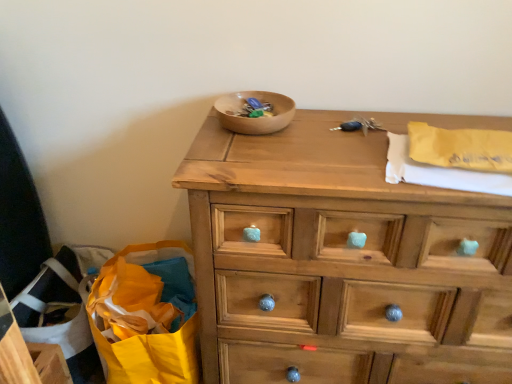
Measure the distance between point (207, 136) and camera.

Point (207, 136) is 3.41 feet away from camera.

This screenshot has height=384, width=512. What do you see at coordinates (439, 172) in the screenshot?
I see `yellow paper at upper right` at bounding box center [439, 172].

Identify the location of wooden bowl at center. The height and width of the screenshot is (384, 512). point(254,118).

Identify the location of yellow paper bag at lower left. (150, 356).

Is wooden chest of drawers at center aimed at yellow paper at upper right?

No, wooden chest of drawers at center is not aimed at yellow paper at upper right.

Is wooden chest of drawers at center thinner than yellow paper at upper right?

In fact, wooden chest of drawers at center might be wider than yellow paper at upper right.

In the image, is wooden chest of drawers at center on the left side or the right side of yellow paper at upper right?

Based on their positions, wooden chest of drawers at center is located to the left of yellow paper at upper right.

Locate an element on the screen. chest of drawers lying on the left of yellow paper at upper right is located at coordinates 341,262.

Looking at this image, can you tell me how much yellow paper at upper right and yellow paper bag at lower left differ in facing direction?

There is a 9.72-degree angle between the facing directions of yellow paper at upper right and yellow paper bag at lower left.

I want to click on shopping bag behind the yellow paper at upper right, so click(150, 356).

Which is closer to the camera, (437, 179) or (181, 373)?

The point (437, 179) is in front.

Is yellow paper at upper right next to yellow paper bag at lower left and touching it?

No, yellow paper at upper right is not with yellow paper bag at lower left.

Could you tell me if yellow paper bag at lower left is facing yellow paper at upper right?

No, yellow paper bag at lower left does not turn towards yellow paper at upper right.

Which is more to the right, yellow paper bag at lower left or yellow paper at upper right?

yellow paper at upper right is more to the right.

Is yellow paper bag at lower left wider or thinner than yellow paper at upper right?

Clearly, yellow paper bag at lower left has more width compared to yellow paper at upper right.

Which object is further away from the camera taking this photo, yellow paper bag at lower left or yellow paper at upper right?

yellow paper bag at lower left is behind.

From the image's perspective, would you say yellow paper bag at lower left is shown under wooden chest of drawers at center?

Correct, yellow paper bag at lower left appears lower than wooden chest of drawers at center in the image.

The width and height of the screenshot is (512, 384). In order to click on the chest of drawers that is in front of the yellow paper bag at lower left in this screenshot , I will do `click(341, 262)`.

Does yellow paper bag at lower left have a greater width compared to wooden chest of drawers at center?

Yes.

From the image's perspective, relative to wooden bowl at center, is wooden chest of drawers at center above or below?

Based on their image positions, wooden chest of drawers at center is located beneath wooden bowl at center.

Is wooden chest of drawers at center looking in the opposite direction of wooden bowl at center?

No.

Who is taller, wooden chest of drawers at center or wooden bowl at center?

Standing taller between the two is wooden chest of drawers at center.

In the image, is wooden chest of drawers at center on the left side or the right side of wooden bowl at center?

From the image, it's evident that wooden chest of drawers at center is to the right of wooden bowl at center.

From the image's perspective, does wooden bowl at center appear higher than yellow paper at upper right?

Yes, from the image's perspective, wooden bowl at center is above yellow paper at upper right.

Between wooden bowl at center and yellow paper at upper right, which one has smaller size?

yellow paper at upper right is smaller.

From a real-world perspective, who is located lower, wooden bowl at center or yellow paper at upper right?

yellow paper at upper right is physically lower.

Is yellow paper at upper right surrounding wooden bowl at center?

No, yellow paper at upper right does not contain wooden bowl at center.

Is yellow paper at upper right looking in the opposite direction of wooden bowl at center?

No, yellow paper at upper right is not facing away from wooden bowl at center.

Considering the sizes of objects yellow paper at upper right and wooden bowl at center in the image provided, who is smaller, yellow paper at upper right or wooden bowl at center?

yellow paper at upper right.

Is yellow paper at upper right taller or shorter than wooden bowl at center?

Clearly, yellow paper at upper right is shorter compared to wooden bowl at center.

The height and width of the screenshot is (384, 512). Find the location of `the chest of drawers that appears in front of the yellow paper at upper right`. the chest of drawers that appears in front of the yellow paper at upper right is located at coordinates click(341, 262).

Identify the location of shopping bag behind the yellow paper at upper right. This screenshot has height=384, width=512. (150, 356).

Considering their positions, is yellow paper bag at lower left positioned closer to wooden chest of drawers at center than yellow paper at upper right?

Among the two, yellow paper at upper right is located nearer to wooden chest of drawers at center.

When comparing their distances from yellow paper at upper right, does wooden chest of drawers at center or wooden bowl at center seem closer?

wooden chest of drawers at center lies closer to yellow paper at upper right than the other object.

Looking at the image, which one is located further to yellow paper bag at lower left, wooden bowl at center or yellow paper at upper right?

Based on the image, yellow paper at upper right appears to be further to yellow paper bag at lower left.

Based on their spatial positions, is yellow paper bag at lower left or wooden bowl at center closer to yellow paper at upper right?

wooden bowl at center lies closer to yellow paper at upper right than the other object.

Based on their spatial positions, is wooden chest of drawers at center or yellow paper bag at lower left further from wooden bowl at center?

Based on the image, yellow paper bag at lower left appears to be further to wooden bowl at center.

Considering their positions, is yellow paper at upper right positioned closer to wooden bowl at center than wooden chest of drawers at center?

Among the two, yellow paper at upper right is located nearer to wooden bowl at center.

From the image, which object appears to be farther from yellow paper at upper right, yellow paper bag at lower left or wooden chest of drawers at center?

yellow paper bag at lower left.

Which object lies further to the anchor point wooden chest of drawers at center, yellow paper at upper right or wooden bowl at center?

wooden bowl at center is further to wooden chest of drawers at center.

You are a GUI agent. You are given a task and a screenshot of the screen. Output one action in this format:
    pyautogui.click(x=<x>, y=<y>)
    Task: Click on the chest of drawers located between yellow paper bag at lower left and yellow paper at upper right in the left-right direction
    Image resolution: width=512 pixels, height=384 pixels.
    Given the screenshot: What is the action you would take?
    pyautogui.click(x=341, y=262)

You are a GUI agent. You are given a task and a screenshot of the screen. Output one action in this format:
    pyautogui.click(x=<x>, y=<y>)
    Task: Click on the bowl situated between yellow paper bag at lower left and yellow paper at upper right from left to right
    Image resolution: width=512 pixels, height=384 pixels.
    Given the screenshot: What is the action you would take?
    pyautogui.click(x=254, y=118)

Find the location of a particular element. bowl between yellow paper bag at lower left and wooden chest of drawers at center in the horizontal direction is located at coordinates (254, 118).

Locate an element on the screen. The image size is (512, 384). the chest of drawers situated between wooden bowl at center and yellow paper at upper right from left to right is located at coordinates (341, 262).